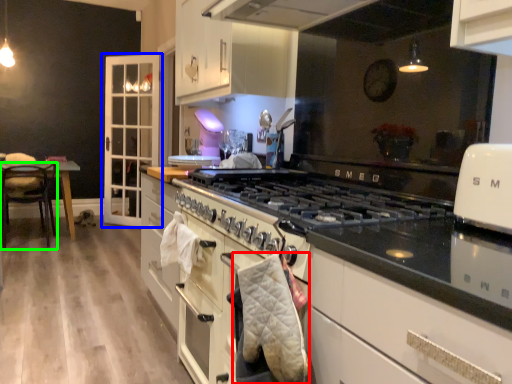
Question: Considering the real-world distances, which object is farthest from blanket (highlighted by a red box)? cabinetry (highlighted by a blue box) or chair (highlighted by a green box)?

Choices:
 (A) cabinetry
 (B) chair

Answer: (A)